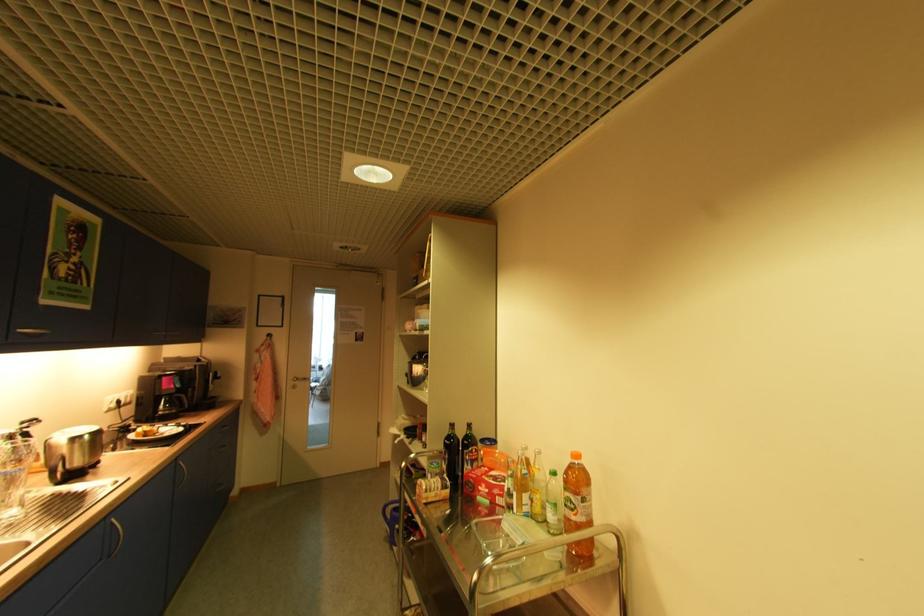
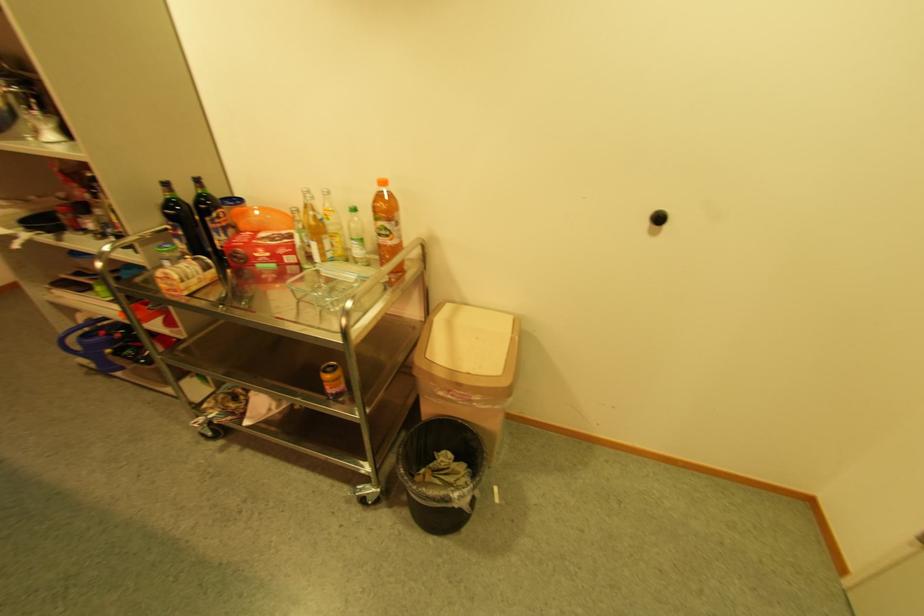
Where in the second image is the point corresponding to point (480, 453) from the first image?

(227, 217)